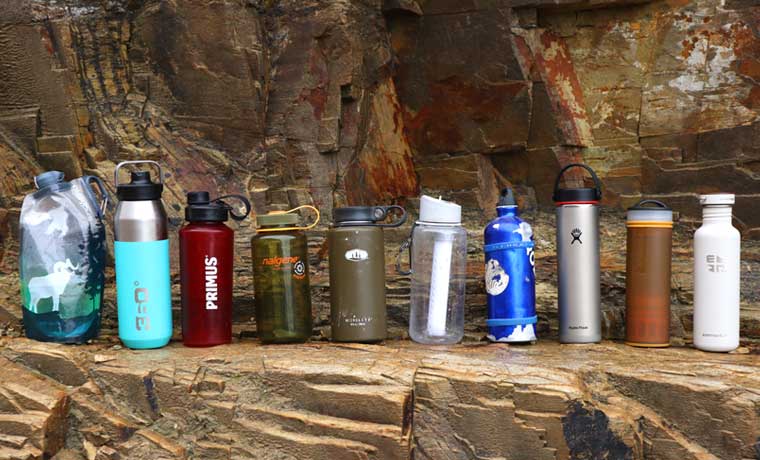
At what (x,y) coordinates should I click in order to perform the action: click on bottles. Please return your answer as a coordinate pair (x, y). Looking at the image, I should click on point(62,285), point(150,244), point(211,249), point(290,252), point(352,247), point(441,240), point(505,242), point(572,232), point(643,246), point(714,251).